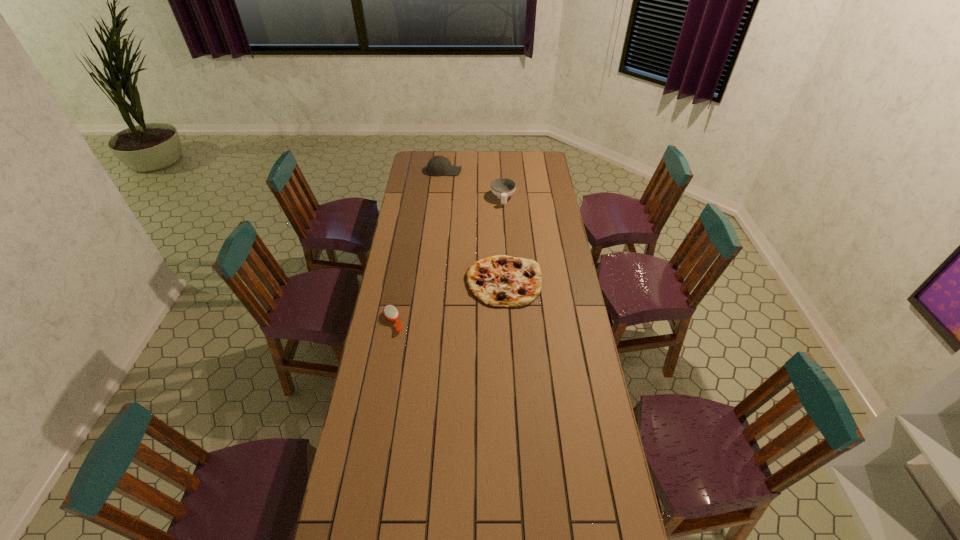
Locate an element on the screen. Image resolution: width=960 pixels, height=540 pixels. vacant region that satisfies the following two spatial constraints: 1. on the front brim of the farthest object; 2. on the back side of the pizza is located at coordinates (433, 281).

Where is `free spot that satisfies the following two spatial constraints: 1. on the back side of the pizza; 2. on the front brim of the tallest object`? free spot that satisfies the following two spatial constraints: 1. on the back side of the pizza; 2. on the front brim of the tallest object is located at coordinates (498, 171).